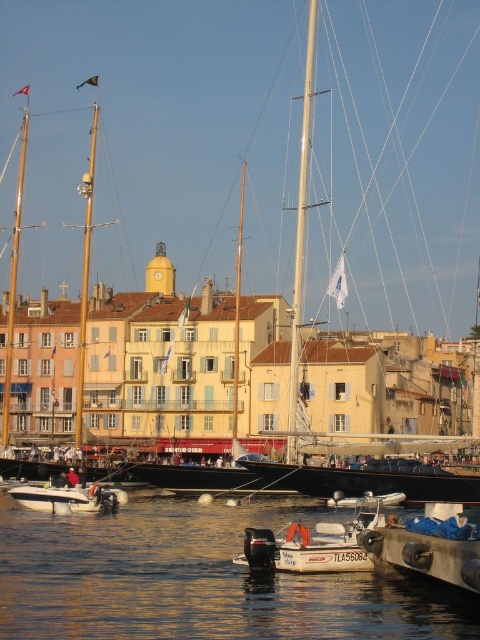
Question: Which point is closer to the camera taking this photo?

Choices:
 (A) (235, 355)
 (B) (307, 177)
 (C) (19, 630)
 (D) (83, 360)

Answer: (C)

Question: Which object is positioned farthest from the white matte boat at center?

Choices:
 (A) white matte mast at center
 (B) white matte motorboat at lower center
 (C) smooth white mast at center

Answer: (A)

Question: Does clear water at lower center appear under white matte sailboat at upper center?

Choices:
 (A) yes
 (B) no

Answer: (A)

Question: Can you confirm if white matte motorboat at lower center is wider than polished wood mast at center?

Choices:
 (A) no
 (B) yes

Answer: (A)

Question: Among these points, which one is farthest from the camera?

Choices:
 (A) (10, 333)
 (B) (300, 547)

Answer: (A)

Question: Does white plastic boat at lower left appear on the left side of polished wood mast at center?

Choices:
 (A) no
 (B) yes

Answer: (A)